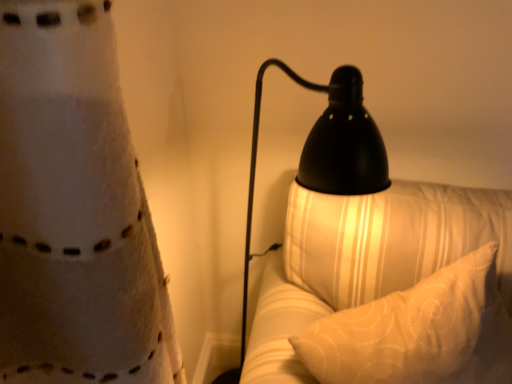
Question: Is black matte lamp at right to the left or to the right of white textured pillow at right in the image?

Choices:
 (A) right
 (B) left

Answer: (B)

Question: From their relative heights in the image, would you say black matte lamp at right is taller or shorter than white textured pillow at right?

Choices:
 (A) tall
 (B) short

Answer: (A)

Question: Considering their positions, is black matte lamp at right located in front of or behind white textured pillow at right?

Choices:
 (A) behind
 (B) front

Answer: (B)

Question: In terms of width, does white textured pillow at right look wider or thinner when compared to black matte lamp at right?

Choices:
 (A) thin
 (B) wide

Answer: (A)

Question: From the image's perspective, is white textured pillow at right positioned above or below black matte lamp at right?

Choices:
 (A) below
 (B) above

Answer: (A)

Question: From a real-world perspective, is white textured pillow at right physically located above or below black matte lamp at right?

Choices:
 (A) above
 (B) below

Answer: (B)

Question: Is white textured pillow at right in front of or behind black matte lamp at right in the image?

Choices:
 (A) behind
 (B) front

Answer: (A)